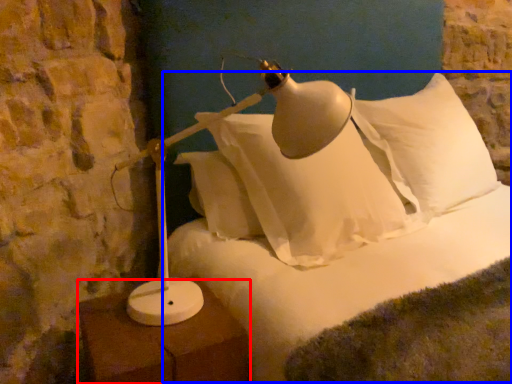
Question: Which point is further to the camera, furniture (highlighted by a red box) or bed (highlighted by a blue box)?

Choices:
 (A) furniture
 (B) bed

Answer: (B)